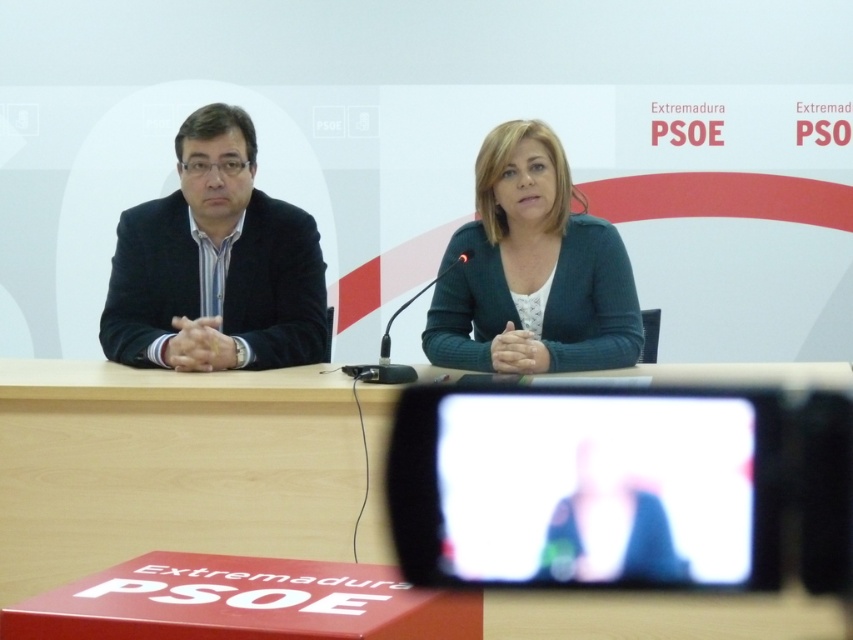
Find the location of a particular element. Image resolution: width=853 pixels, height=640 pixels. matte black suit at left is located at coordinates (215, 264).

Between point (285, 241) and point (527, 282), which one is positioned in front?

Positioned in front is point (527, 282).

Which is behind, point (178, 180) or point (608, 304)?

The point (178, 180) is behind.

The image size is (853, 640). In order to click on matte black suit at left in this screenshot , I will do `click(215, 264)`.

Does wooden table at center appear over matte black suit at left?

No, wooden table at center is not above matte black suit at left.

Is wooden table at center in front of matte black suit at left?

That is True.

Who is more forward, (x=7, y=445) or (x=291, y=365)?

Point (x=7, y=445)

Find the location of a particular element. wooden table at center is located at coordinates (169, 467).

What do you see at coordinates (596, 488) in the screenshot?
I see `white glossy monitor at center` at bounding box center [596, 488].

Does white glossy monitor at center have a lesser width compared to green knitted cardigan at center?

No.

Between point (740, 522) and point (529, 336), which one is positioned in front?

Point (740, 522) is in front.

At what (x,y) coordinates should I click in order to perform the action: click on white glossy monitor at center. Please return your answer as a coordinate pair (x, y). Looking at the image, I should click on (596, 488).